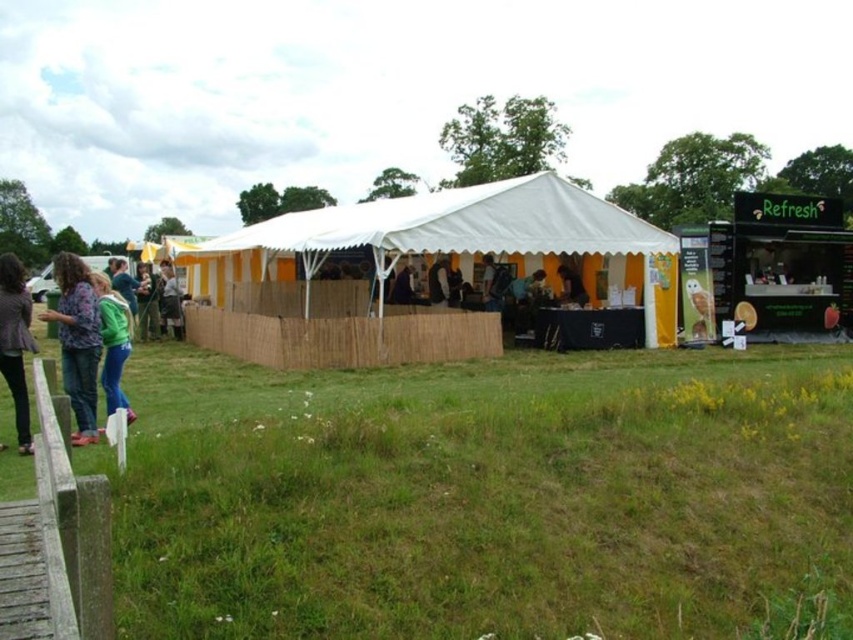
You are standing in a field and see the green grass at lower center and the green fleece jacket at left. Which object is wider?

The green grass at lower center is wider than the green fleece jacket at left.

You are standing in the middle of the grassy field and want to walk towards the tent. There is a wooden fence in front of you. Which object, the green grass at lower center or the green fleece jacket at left, is closer to you as you approach the fence?

The green grass at lower center is closer to you as you approach the fence because it is in the foreground, while the green fleece jacket at left is further back inside the tent area.